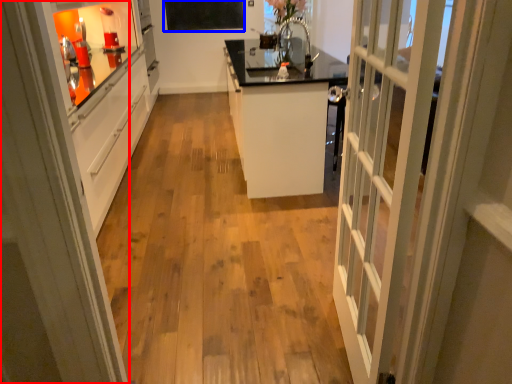
Question: Which object appears closest to the camera in this image, door (highlighted by a red box) or bulletin board (highlighted by a blue box)?

Choices:
 (A) door
 (B) bulletin board

Answer: (A)